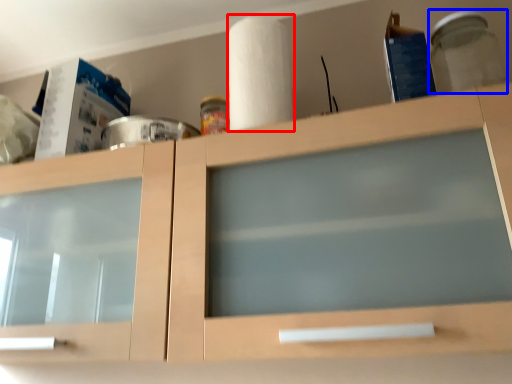
Question: Which point is further to the camera, paper towel (highlighted by a red box) or glass jar (highlighted by a blue box)?

Choices:
 (A) paper towel
 (B) glass jar

Answer: (A)